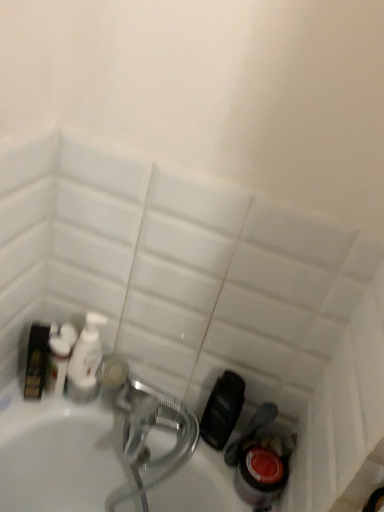
Where is `white glossy bottle at left, which ranks as the first cleaning product in left-to-right order`? white glossy bottle at left, which ranks as the first cleaning product in left-to-right order is located at coordinates (59, 358).

The width and height of the screenshot is (384, 512). What do you see at coordinates (59, 358) in the screenshot? I see `white glossy bottle at left, which appears as the second cleaning product when viewed from the right` at bounding box center [59, 358].

In order to face white glossy pump bottle at center, acting as the second cleaning product starting from the left, should I rotate leftwards or rightwards?

Turn left by 13.898 degrees to look at white glossy pump bottle at center, acting as the second cleaning product starting from the left.

The width and height of the screenshot is (384, 512). In order to click on white glossy pump bottle at center, acting as the second cleaning product starting from the left in this screenshot , I will do `click(86, 361)`.

Consider the image. What is the approximate height of white glossy pump bottle at center, acting as the second cleaning product starting from the left?

white glossy pump bottle at center, acting as the second cleaning product starting from the left, is 24.68 centimeters in height.

Describe the element at coordinates (86, 361) in the screenshot. I see `white glossy pump bottle at center, which appears as the first cleaning product when viewed from the right` at that location.

Where is `white glossy bottle at left, which appears as the second cleaning product when viewed from the right`? Image resolution: width=384 pixels, height=512 pixels. white glossy bottle at left, which appears as the second cleaning product when viewed from the right is located at coordinates (59, 358).

Considering the relative positions of white glossy pump bottle at center, which appears as the first cleaning product when viewed from the right, and white glossy bottle at left, which appears as the second cleaning product when viewed from the right, in the image provided, is white glossy pump bottle at center, which appears as the first cleaning product when viewed from the right, to the left of white glossy bottle at left, which appears as the second cleaning product when viewed from the right, from the viewer's perspective?

In fact, white glossy pump bottle at center, which appears as the first cleaning product when viewed from the right, is to the right of white glossy bottle at left, which appears as the second cleaning product when viewed from the right.

Which is in front, white glossy pump bottle at center, acting as the second cleaning product starting from the left, or white glossy bottle at left, which ranks as the first cleaning product in left-to-right order?

white glossy bottle at left, which ranks as the first cleaning product in left-to-right order.

Is point (85, 379) closer or farther from the camera than point (68, 349)?

Point (85, 379).

From the image's perspective, relative to white glossy bottle at left, which ranks as the first cleaning product in left-to-right order, is white glossy pump bottle at center, acting as the second cleaning product starting from the left, above or below?

From the image's perspective, white glossy pump bottle at center, acting as the second cleaning product starting from the left, appears below white glossy bottle at left, which ranks as the first cleaning product in left-to-right order.

From a real-world perspective, is white glossy pump bottle at center, acting as the second cleaning product starting from the left, positioned under white glossy bottle at left, which ranks as the first cleaning product in left-to-right order, based on gravity?

Yes, from a real-world perspective, white glossy pump bottle at center, acting as the second cleaning product starting from the left, is under white glossy bottle at left, which ranks as the first cleaning product in left-to-right order.

Between white glossy pump bottle at center, acting as the second cleaning product starting from the left, and white glossy bottle at left, which ranks as the first cleaning product in left-to-right order, which one has smaller width?

white glossy bottle at left, which ranks as the first cleaning product in left-to-right order, is thinner.

Considering the sizes of white glossy pump bottle at center, acting as the second cleaning product starting from the left, and white glossy bottle at left, which ranks as the first cleaning product in left-to-right order, in the image, is white glossy pump bottle at center, acting as the second cleaning product starting from the left, taller or shorter than white glossy bottle at left, which ranks as the first cleaning product in left-to-right order,?

white glossy pump bottle at center, acting as the second cleaning product starting from the left, is taller than white glossy bottle at left, which ranks as the first cleaning product in left-to-right order.

Who is smaller, white glossy pump bottle at center, which appears as the first cleaning product when viewed from the right, or white glossy bottle at left, which ranks as the first cleaning product in left-to-right order?

With smaller size is white glossy bottle at left, which ranks as the first cleaning product in left-to-right order.

From the picture: Is white glossy pump bottle at center, acting as the second cleaning product starting from the left, situated inside white glossy bottle at left, which appears as the second cleaning product when viewed from the right, or outside?

white glossy pump bottle at center, acting as the second cleaning product starting from the left, cannot be found inside white glossy bottle at left, which appears as the second cleaning product when viewed from the right.

Is white glossy pump bottle at center, acting as the second cleaning product starting from the left, with white glossy bottle at left, which ranks as the first cleaning product in left-to-right order?

Yes, white glossy pump bottle at center, acting as the second cleaning product starting from the left, is next to white glossy bottle at left, which ranks as the first cleaning product in left-to-right order.

Is white glossy pump bottle at center, acting as the second cleaning product starting from the left, facing towards white glossy bottle at left, which appears as the second cleaning product when viewed from the right?

No, white glossy pump bottle at center, acting as the second cleaning product starting from the left, does not turn towards white glossy bottle at left, which appears as the second cleaning product when viewed from the right.

How different are the orientations of white glossy pump bottle at center, which appears as the first cleaning product when viewed from the right, and white glossy bottle at left, which ranks as the first cleaning product in left-to-right order, in degrees?

The angular difference between white glossy pump bottle at center, which appears as the first cleaning product when viewed from the right, and white glossy bottle at left, which ranks as the first cleaning product in left-to-right order, is 0.00112 degrees.

This screenshot has width=384, height=512. Find the location of `cleaning product above the white glossy pump bottle at center, which appears as the first cleaning product when viewed from the right (from a real-world perspective)`. cleaning product above the white glossy pump bottle at center, which appears as the first cleaning product when viewed from the right (from a real-world perspective) is located at coordinates point(59,358).

Visually, is white glossy bottle at left, which appears as the second cleaning product when viewed from the right, positioned to the left or to the right of white glossy pump bottle at center, acting as the second cleaning product starting from the left?

From the image, it's evident that white glossy bottle at left, which appears as the second cleaning product when viewed from the right, is to the left of white glossy pump bottle at center, acting as the second cleaning product starting from the left.

Who is more distant, white glossy bottle at left, which ranks as the first cleaning product in left-to-right order, or white glossy pump bottle at center, acting as the second cleaning product starting from the left?

white glossy pump bottle at center, acting as the second cleaning product starting from the left.

Is point (58, 338) positioned after point (77, 346)?

Yes, it is.

From the image's perspective, relative to white glossy pump bottle at center, which appears as the first cleaning product when viewed from the right, is white glossy bottle at left, which ranks as the first cleaning product in left-to-right order, above or below?

Clearly, from the image's perspective, white glossy bottle at left, which ranks as the first cleaning product in left-to-right order, is above white glossy pump bottle at center, which appears as the first cleaning product when viewed from the right.

From a real-world perspective, between white glossy bottle at left, which ranks as the first cleaning product in left-to-right order, and white glossy pump bottle at center, which appears as the first cleaning product when viewed from the right, who is vertically lower?

white glossy pump bottle at center, which appears as the first cleaning product when viewed from the right, from a real-world perspective.

Can you confirm if white glossy bottle at left, which appears as the second cleaning product when viewed from the right, is thinner than white glossy pump bottle at center, which appears as the first cleaning product when viewed from the right?

Indeed, white glossy bottle at left, which appears as the second cleaning product when viewed from the right, has a lesser width compared to white glossy pump bottle at center, which appears as the first cleaning product when viewed from the right.

Is white glossy bottle at left, which appears as the second cleaning product when viewed from the right, shorter than white glossy pump bottle at center, which appears as the first cleaning product when viewed from the right?

Correct, white glossy bottle at left, which appears as the second cleaning product when viewed from the right, is not as tall as white glossy pump bottle at center, which appears as the first cleaning product when viewed from the right.

Considering the sizes of objects white glossy bottle at left, which ranks as the first cleaning product in left-to-right order, and white glossy pump bottle at center, which appears as the first cleaning product when viewed from the right, in the image provided, who is bigger, white glossy bottle at left, which ranks as the first cleaning product in left-to-right order, or white glossy pump bottle at center, which appears as the first cleaning product when viewed from the right,?

white glossy pump bottle at center, which appears as the first cleaning product when viewed from the right.

Which is correct: white glossy bottle at left, which appears as the second cleaning product when viewed from the right, is inside white glossy pump bottle at center, which appears as the first cleaning product when viewed from the right, or outside of it?

white glossy bottle at left, which appears as the second cleaning product when viewed from the right, is located beyond the bounds of white glossy pump bottle at center, which appears as the first cleaning product when viewed from the right.

Does white glossy bottle at left, which appears as the second cleaning product when viewed from the right, touch white glossy pump bottle at center, which appears as the first cleaning product when viewed from the right?

Yes, white glossy bottle at left, which appears as the second cleaning product when viewed from the right, is beside white glossy pump bottle at center, which appears as the first cleaning product when viewed from the right.

Is white glossy bottle at left, which ranks as the first cleaning product in left-to-right order, aimed at white glossy pump bottle at center, which appears as the first cleaning product when viewed from the right?

No, white glossy bottle at left, which ranks as the first cleaning product in left-to-right order, is not facing towards white glossy pump bottle at center, which appears as the first cleaning product when viewed from the right.

How many degrees apart are the facing directions of white glossy bottle at left, which appears as the second cleaning product when viewed from the right, and white glossy pump bottle at center, which appears as the first cleaning product when viewed from the right?

white glossy bottle at left, which appears as the second cleaning product when viewed from the right, and white glossy pump bottle at center, which appears as the first cleaning product when viewed from the right, are facing 0.00112 degrees away from each other.

How distant is white glossy bottle at left, which ranks as the first cleaning product in left-to-right order, from white glossy pump bottle at center, which appears as the first cleaning product when viewed from the right?

A distance of 4.22 centimeters exists between white glossy bottle at left, which ranks as the first cleaning product in left-to-right order, and white glossy pump bottle at center, which appears as the first cleaning product when viewed from the right.

Find the location of a particular element. cleaning product above the white glossy pump bottle at center, which appears as the first cleaning product when viewed from the right (from the image's perspective) is located at coordinates (59, 358).

This screenshot has width=384, height=512. Identify the location of cleaning product that is above the white glossy pump bottle at center, acting as the second cleaning product starting from the left (from a real-world perspective). (59, 358).

This screenshot has width=384, height=512. What are the coordinates of `cleaning product below the white glossy bottle at left, which ranks as the first cleaning product in left-to-right order (from a real-world perspective)` in the screenshot? It's located at (86, 361).